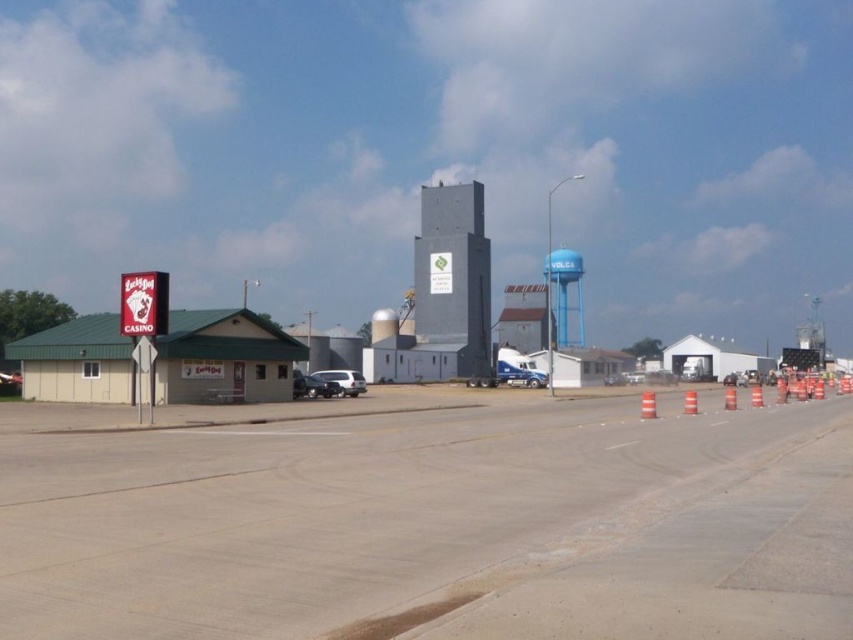
You are standing at the road with the orange and white traffic cones on the right side. There are two points in the image labeled as point 1 at coordinates (567, 422) and point 2 at coordinates (554, 304). Which point is closer to you?

Point 1 at coordinates (567, 422) is closer to the viewer than point 2 at coordinates (554, 304).